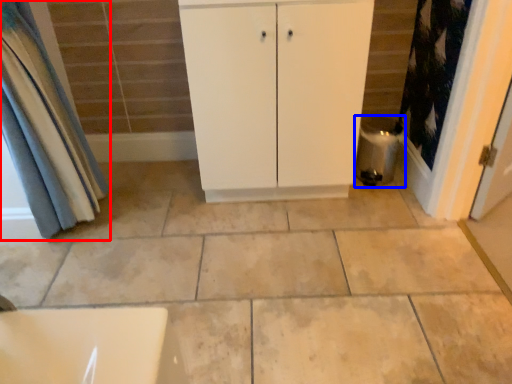
Question: Which object appears closest to the camera in this image, curtain (highlighted by a red box) or water heater (highlighted by a blue box)?

Choices:
 (A) curtain
 (B) water heater

Answer: (A)